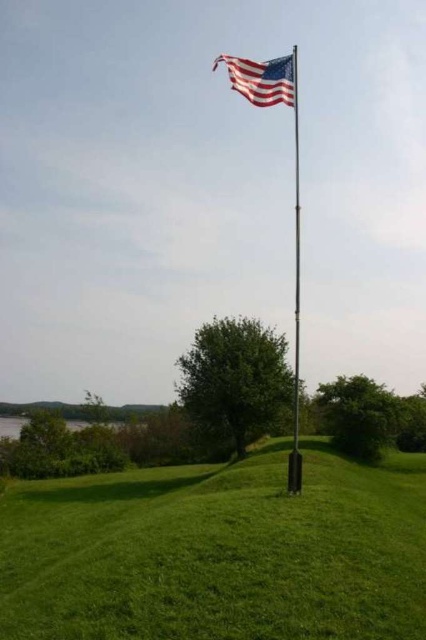
You are standing in the outdoor scene with the flagpole and trees. There are two points marked in the image. The first point is at coordinates point (x=213, y=483) and the second point is at point (x=261, y=72). Which of these two points is closer to you?

Point (x=261, y=72) is closer to you because the description states that point (x=213, y=483) is further to the camera than point (x=261, y=72).

You are a photographer trying to capture the american flag at upper center and the metallic flag pole at center in a single shot. Given that the flag is smaller than the pole, how might you adjust your camera position to ensure both are clearly visible?

Since the american flag at upper center is smaller than the metallic flag pole at center, you should position the camera closer to the flagpole to balance their sizes in the frame, ensuring both are clearly visible.

You are a landscape architect designing a new park layout. You need to place a new bench between the green grass at center and the american flag at upper center. Which side of the bench should face the wider area to ensure visitors have an unobstructed view of the wider space?

The green grass at center is wider than the american flag at upper center, so the bench should face the green grass at center to provide an unobstructed view of the wider area.